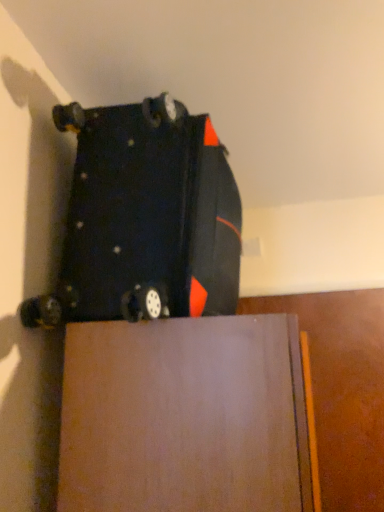
Where is `matte black suitcase at center`? matte black suitcase at center is located at coordinates (145, 218).

Describe the element at coordinates (145, 218) in the screenshot. The width and height of the screenshot is (384, 512). I see `matte black suitcase at center` at that location.

Identify the location of matte black suitcase at center. This screenshot has width=384, height=512. (145, 218).